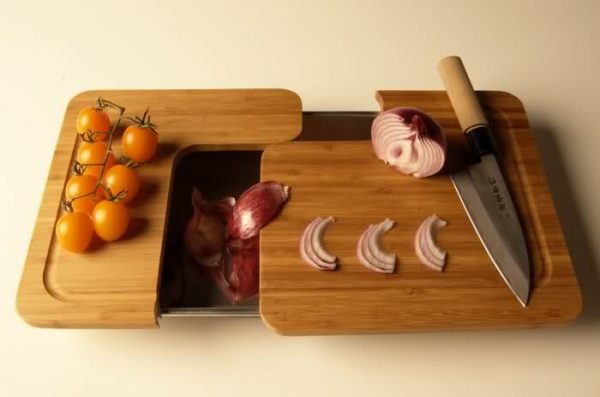
At what (x,y) coordinates should I click in order to perform the action: click on cutting board. Please return your answer as a coordinate pair (x, y). Image resolution: width=600 pixels, height=397 pixels. Looking at the image, I should click on (343, 194).